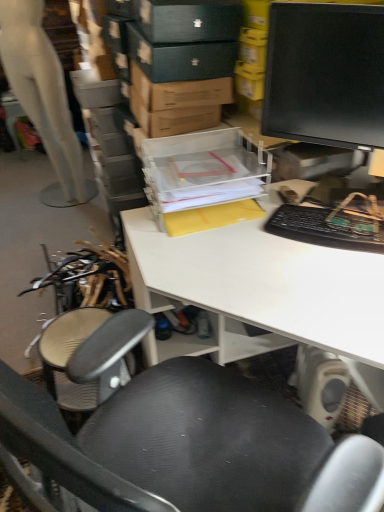
What do you see at coordinates (325, 74) in the screenshot?
I see `matte black monitor at upper right` at bounding box center [325, 74].

Image resolution: width=384 pixels, height=512 pixels. Describe the element at coordinates (268, 287) in the screenshot. I see `white matte desk at center` at that location.

Measure the distance between point (325, 436) and camera.

A distance of 36.69 inches exists between point (325, 436) and camera.

At what (x,y) coordinates should I click in order to perform the action: click on white matte mannequin at left. Please return your answer as a coordinate pair (x, y). The height and width of the screenshot is (512, 384). Looking at the image, I should click on (43, 97).

What's the angular difference between transparent plastic storage box at center and white matte desk at center's facing directions?

There is a 85.8-degree angle between the facing directions of transparent plastic storage box at center and white matte desk at center.

Between transparent plastic storage box at center and white matte desk at center, which one appears on the left side from the viewer's perspective?

From the viewer's perspective, transparent plastic storage box at center appears more on the left side.

Where is `desk below the transparent plastic storage box at center (from a real-world perspective)`? desk below the transparent plastic storage box at center (from a real-world perspective) is located at coordinates (268, 287).

Consider the image. Measure the distance between transparent plastic storage box at center and white matte desk at center.

transparent plastic storage box at center is 7.48 inches away from white matte desk at center.

The image size is (384, 512). Identify the location of storage box located above the white matte mannequin at left (from a real-world perspective). pyautogui.click(x=203, y=180).

From the image's perspective, is transparent plastic storage box at center positioned above or below white matte mannequin at left?

Based on their image positions, transparent plastic storage box at center is located beneath white matte mannequin at left.

Is transparent plastic storage box at center located outside white matte mannequin at left?

Yes, transparent plastic storage box at center is located beyond the bounds of white matte mannequin at left.

Which object is closer to the camera, white matte mannequin at left or transparent plastic storage box at center?

transparent plastic storage box at center is more forward.

Is white matte mannequin at left not near transparent plastic storage box at center?

Yes, white matte mannequin at left and transparent plastic storage box at center are located far from each other.

Is white matte mannequin at left oriented away from transparent plastic storage box at center?

No, white matte mannequin at left's orientation is not away from transparent plastic storage box at center.

From a real-world perspective, is white matte mannequin at left physically below transparent plastic storage box at center?

Yes.

At what (x,y) coordinates should I click in order to perform the action: click on computer monitor behind the transparent plastic storage box at center. Please return your answer as a coordinate pair (x, y). This screenshot has height=512, width=384. Looking at the image, I should click on (325, 74).

Is matte black monitor at upper right wider than transparent plastic storage box at center?

Correct, the width of matte black monitor at upper right exceeds that of transparent plastic storage box at center.

Looking at this image, is matte black monitor at upper right far from transparent plastic storage box at center?

No, there isn't a large distance between matte black monitor at upper right and transparent plastic storage box at center.

Considering the relative positions of matte black monitor at upper right and transparent plastic storage box at center in the image provided, is matte black monitor at upper right to the left of transparent plastic storage box at center from the viewer's perspective?

No.

How different are the orientations of matte black monitor at upper right and white matte mannequin at left in degrees?

They differ by 54.4 degrees in their facing directions.

Between matte black monitor at upper right and white matte mannequin at left, which one has smaller size?

Smaller between the two is matte black monitor at upper right.

Looking at this image, which of these two, matte black monitor at upper right or white matte mannequin at left, stands taller?

white matte mannequin at left is taller.

From a real-world perspective, which is physically below, matte black monitor at upper right or white matte mannequin at left?

white matte mannequin at left.

Between white matte desk at center and black textured chair at center, which one appears on the right side from the viewer's perspective?

Positioned to the right is white matte desk at center.

Which of these two, white matte desk at center or black textured chair at center, is thinner?

black textured chair at center.

From the image's perspective, is white matte desk at center under black textured chair at center?

Incorrect, from the image's perspective, white matte desk at center is higher than black textured chair at center.

Are white matte mannequin at left and white matte desk at center located far from each other?

Indeed, white matte mannequin at left is not near white matte desk at center.

From the image's perspective, is white matte mannequin at left located above or below white matte desk at center?

white matte mannequin at left is situated higher than white matte desk at center in the image.

Is white matte mannequin at left to the right of white matte desk at center from the viewer's perspective?

In fact, white matte mannequin at left is to the left of white matte desk at center.

Which is less distant, (x=20, y=31) or (x=148, y=288)?

The point (x=148, y=288) is closer.

This screenshot has height=512, width=384. Find the location of `desk below the transparent plastic storage box at center (from the image's perspective)`. desk below the transparent plastic storage box at center (from the image's perspective) is located at coordinates (268, 287).

I want to click on person above the transparent plastic storage box at center (from the image's perspective), so click(43, 97).

Estimate the real-world distances between objects in this image. Which object is closer to matte black monitor at upper right, black textured chair at center or white matte desk at center?

white matte desk at center.

Looking at the image, which one is located closer to black plastic keyboard at right, matte black monitor at upper right or white matte mannequin at left?

matte black monitor at upper right lies closer to black plastic keyboard at right than the other object.

Which object lies nearer to the anchor point white matte mannequin at left, transparent plastic storage box at center or white matte desk at center?

transparent plastic storage box at center.

When comparing their distances from white matte desk at center, does black textured chair at center or transparent plastic storage box at center seem further?

Among the two, black textured chair at center is located further to white matte desk at center.

Based on their spatial positions, is matte black monitor at upper right or black plastic keyboard at right closer to white matte mannequin at left?

Based on the image, matte black monitor at upper right appears to be nearer to white matte mannequin at left.

Looking at the image, which one is located further to white matte mannequin at left, matte black monitor at upper right or transparent plastic storage box at center?

matte black monitor at upper right.

Looking at this image, considering their positions, is white matte mannequin at left positioned closer to black textured chair at center than matte black monitor at upper right?

matte black monitor at upper right.

Estimate the real-world distances between objects in this image. Which object is closer to black textured chair at center, matte black monitor at upper right or transparent plastic storage box at center?

transparent plastic storage box at center is positioned closer to the anchor black textured chair at center.

You are a GUI agent. You are given a task and a screenshot of the screen. Output one action in this format:
    pyautogui.click(x=<x>, y=<y>)
    Task: Click on the storage box between matte black monitor at upper right and white matte desk at center vertically
    This screenshot has width=384, height=512.
    Given the screenshot: What is the action you would take?
    [203, 180]

At what (x,y) coordinates should I click in order to perform the action: click on computer keyboard that lies between matte black monitor at upper right and black textured chair at center from top to bottom. Please return your answer as a coordinate pair (x, y). The image size is (384, 512). Looking at the image, I should click on (319, 229).

You are a GUI agent. You are given a task and a screenshot of the screen. Output one action in this format:
    pyautogui.click(x=<x>, y=<y>)
    Task: Click on the desk located between black textured chair at center and transparent plastic storage box at center in the depth direction
    
    Given the screenshot: What is the action you would take?
    pyautogui.click(x=268, y=287)

Where is `computer keyboard between white matte desk at center and transparent plastic storage box at center from front to back`? The height and width of the screenshot is (512, 384). computer keyboard between white matte desk at center and transparent plastic storage box at center from front to back is located at coordinates (319, 229).